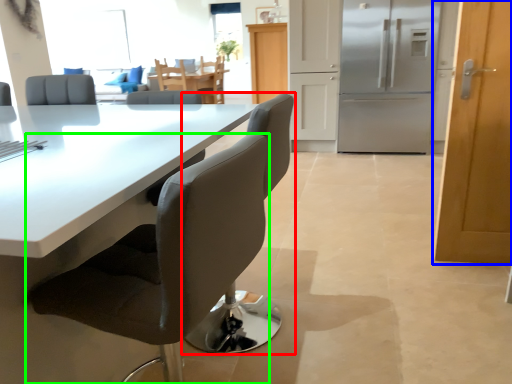
Question: Which object is the farthest from chair (highlighted by a red box)? Choose among these: door (highlighted by a blue box) or chair (highlighted by a green box).

Choices:
 (A) door
 (B) chair

Answer: (A)